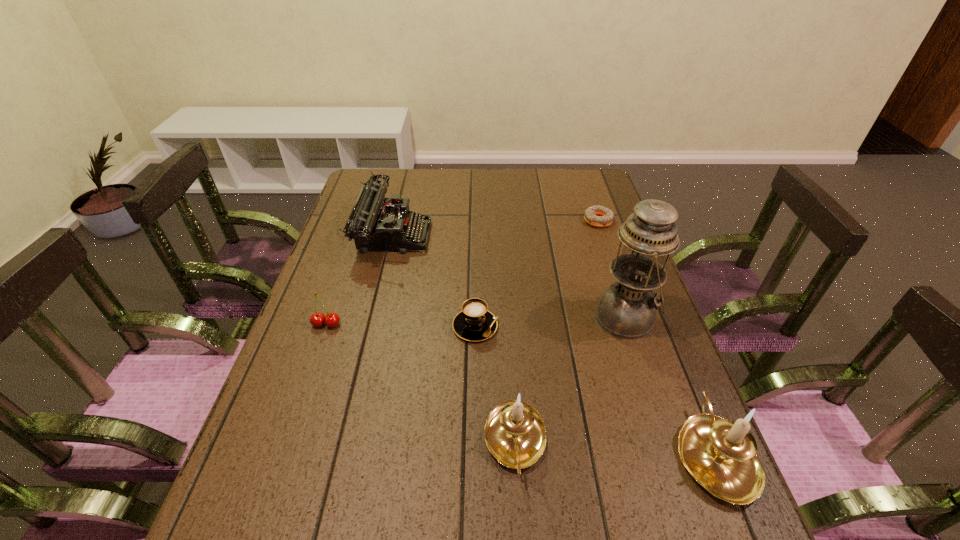
Where is `free space that satisfies the following two spatial constraints: 1. on the keyboard of the typewriter; 2. on the back side of the cappuccino`? free space that satisfies the following two spatial constraints: 1. on the keyboard of the typewriter; 2. on the back side of the cappuccino is located at coordinates (371, 326).

Identify the location of free space that satisfies the following two spatial constraints: 1. on the keyboard of the typewriter; 2. with the stems of the cherry pointing upwards. Image resolution: width=960 pixels, height=540 pixels. (372, 324).

Where is `free space that satisfies the following two spatial constraints: 1. on the keyboard of the typewriter; 2. on the right side of the tallest object`? The height and width of the screenshot is (540, 960). free space that satisfies the following two spatial constraints: 1. on the keyboard of the typewriter; 2. on the right side of the tallest object is located at coordinates (372, 317).

The height and width of the screenshot is (540, 960). I want to click on vacant area in the image that satisfies the following two spatial constraints: 1. on the back side of the doughnut; 2. on the right side of the cappuccino, so click(x=477, y=221).